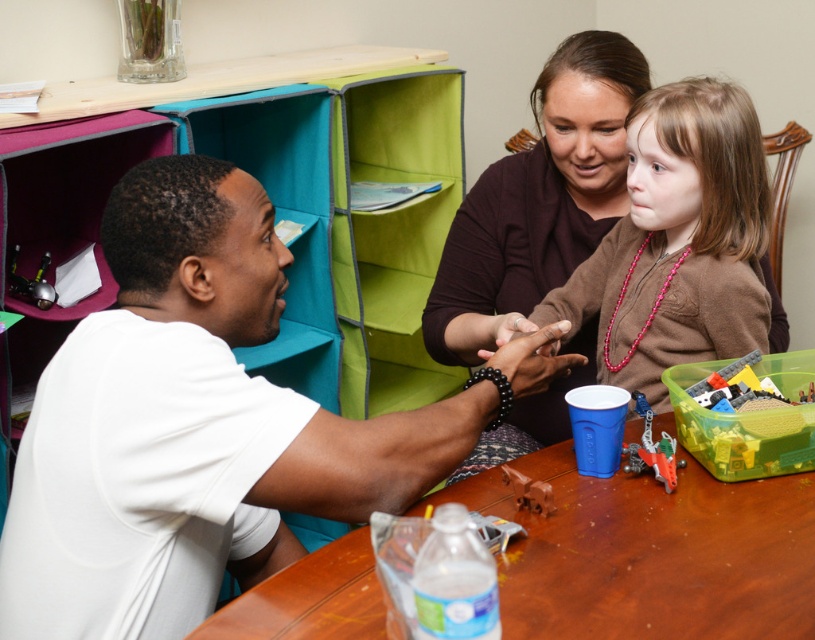
Question: Does translucent plastic container at lower right have a smaller size compared to metallic red toy airplane at lower center?

Choices:
 (A) yes
 (B) no

Answer: (B)

Question: Which of the following is the farthest from the observer?

Choices:
 (A) brown matte sweater at center
 (B) translucent plastic container at lower right
 (C) brown matte horse at lower center

Answer: (A)

Question: Which point is farther to the camera?

Choices:
 (A) (95, 449)
 (B) (717, 209)
 (C) (668, 442)
 (D) (521, 480)

Answer: (B)

Question: Is matte brown sweater at center wider than brown matte horse at lower center?

Choices:
 (A) no
 (B) yes

Answer: (B)

Question: Can you confirm if brown wooden table at center is wider than brown matte sweater at center?

Choices:
 (A) no
 (B) yes

Answer: (B)

Question: Which is nearer to the brown wooden table at center?

Choices:
 (A) metallic red toy airplane at lower center
 (B) brown matte horse at lower center
 (C) brown matte sweater at center

Answer: (B)